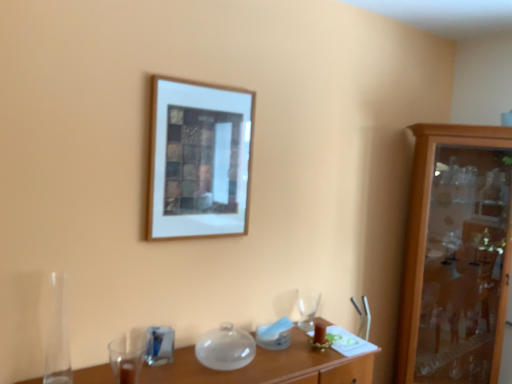
Image resolution: width=512 pixels, height=384 pixels. What do you see at coordinates (307, 308) in the screenshot?
I see `clear glass wine glass at center, the 2th tableware when ordered from left to right` at bounding box center [307, 308].

At what (x,y) coordinates should I click in order to perform the action: click on transparent glass vase at lower left. Please return your answer as a coordinate pair (x, y). Looking at the image, I should click on (57, 334).

Find the location of `translucent glass table at lower center`. translucent glass table at lower center is located at coordinates (269, 367).

Is blue glass at lower left, the 1th tableware in the front-to-back sequence, next to wooden picture frame at upper center?

No, blue glass at lower left, the 1th tableware in the front-to-back sequence, is not with wooden picture frame at upper center.

Which point is more forward, [162,359] or [182,216]?

The point [162,359] is closer to the camera.

Looking at this image, considering the sizes of objects blue glass at lower left, the first tableware positioned from the left, and wooden picture frame at upper center in the image provided, who is shorter, blue glass at lower left, the first tableware positioned from the left, or wooden picture frame at upper center?

blue glass at lower left, the first tableware positioned from the left.

Is blue glass at lower left, the 2th tableware positioned from the right, inside the boundaries of wooden picture frame at upper center, or outside?

blue glass at lower left, the 2th tableware positioned from the right, is not inside wooden picture frame at upper center, it's outside.

Which is more to the left, transparent glass vase at lower left or blue glass at lower left, the 2th tableware positioned from the right?

From the viewer's perspective, transparent glass vase at lower left appears more on the left side.

Which point is more distant from viewer, (53,275) or (162,356)?

The point (162,356) is farther.

Consider the image. Measure the distance between transparent glass vase at lower left and blue glass at lower left, the 2th tableware in the back-to-front sequence.

The distance of transparent glass vase at lower left from blue glass at lower left, the 2th tableware in the back-to-front sequence, is 14.88 inches.

Could you tell me if transparent glass vase at lower left is turned towards blue glass at lower left, the 1th tableware in the front-to-back sequence?

No.

How far apart are wooden cabinet at right and transparent glass vase at lower left?

They are 2.20 meters apart.

From a real-world perspective, is wooden cabinet at right beneath transparent glass vase at lower left?

Actually, wooden cabinet at right is physically above transparent glass vase at lower left in the real world.

Are wooden cabinet at right and transparent glass vase at lower left beside each other?

wooden cabinet at right and transparent glass vase at lower left are clearly separated.

Does point (485, 310) come in front of point (55, 300)?

No, (485, 310) is further to viewer.

In the scene shown: Does wooden picture frame at upper center have a smaller size compared to wooden cabinet at right?

Correct, wooden picture frame at upper center occupies less space than wooden cabinet at right.

Which point is more forward, (204, 84) or (450, 195)?

The point (204, 84) is closer.

Looking at this image, from a real-world perspective, who is located higher, wooden picture frame at upper center or wooden cabinet at right?

In real-world perspective, wooden picture frame at upper center is above.

You are a GUI agent. You are given a task and a screenshot of the screen. Output one action in this format:
    pyautogui.click(x=<x>, y=<y>)
    Task: Click on the picture frame that is on the left side of wooden cabinet at right
    This screenshot has height=384, width=512.
    Given the screenshot: What is the action you would take?
    pyautogui.click(x=199, y=160)

From a real-world perspective, which is physically above, blue glass at lower left, the 2th tableware positioned from the right, or transparent glass vase at lower left?

transparent glass vase at lower left is physically above.

Which object is positioned more to the right, blue glass at lower left, the 1th tableware in the front-to-back sequence, or transparent glass vase at lower left?

Positioned to the right is blue glass at lower left, the 1th tableware in the front-to-back sequence.

From the image's perspective, who appears lower, blue glass at lower left, the first tableware positioned from the left, or transparent glass vase at lower left?

blue glass at lower left, the first tableware positioned from the left, is shown below in the image.

Is blue glass at lower left, the 1th tableware in the front-to-back sequence, in front of or behind transparent glass vase at lower left in the image?

Clearly, blue glass at lower left, the 1th tableware in the front-to-back sequence, is behind transparent glass vase at lower left.

Is translucent glass table at lower center thinner than clear glass wine glass at center, marked as the 1th tableware in a right-to-left arrangement?

In fact, translucent glass table at lower center might be wider than clear glass wine glass at center, marked as the 1th tableware in a right-to-left arrangement.

Does translucent glass table at lower center have a larger size compared to clear glass wine glass at center, marked as the 1th tableware in a right-to-left arrangement?

Correct, translucent glass table at lower center is larger in size than clear glass wine glass at center, marked as the 1th tableware in a right-to-left arrangement.

Is translucent glass table at lower center taller or shorter than clear glass wine glass at center, the first tableware from the back?

translucent glass table at lower center is taller than clear glass wine glass at center, the first tableware from the back.

Can you confirm if translucent glass table at lower center is positioned to the right of clear glass wine glass at center, the first tableware from the back?

No.

How different are the orientations of clear glass wine glass at center, the first tableware from the back, and translucent glass table at lower center in degrees?

They differ by 1.75 degrees in their facing directions.

From the image's perspective, between clear glass wine glass at center, the second tableware viewed from the front, and translucent glass table at lower center, which one is located above?

clear glass wine glass at center, the second tableware viewed from the front.

Is there a large distance between clear glass wine glass at center, the second tableware viewed from the front, and translucent glass table at lower center?

clear glass wine glass at center, the second tableware viewed from the front, is near translucent glass table at lower center, not far away.

Do you think clear glass wine glass at center, marked as the 1th tableware in a right-to-left arrangement, is within translucent glass table at lower center, or outside of it?

clear glass wine glass at center, marked as the 1th tableware in a right-to-left arrangement, is outside translucent glass table at lower center.

Locate an element on the screen. picture frame above the blue glass at lower left, the first tableware positioned from the left (from a real-world perspective) is located at coordinates (199, 160).

Find the location of a particular element. The height and width of the screenshot is (384, 512). glass vase above the blue glass at lower left, the first tableware positioned from the left (from the image's perspective) is located at coordinates (57, 334).

When comparing their distances from wooden picture frame at upper center, does blue glass at lower left, the 2th tableware positioned from the right, or translucent glass table at lower center seem closer?

blue glass at lower left, the 2th tableware positioned from the right.

Considering their positions, is transparent glass vase at lower left positioned closer to wooden cabinet at right than wooden picture frame at upper center?

wooden picture frame at upper center.

Considering their positions, is wooden picture frame at upper center positioned further to clear glass wine glass at center, the first tableware from the back, than translucent glass table at lower center?

wooden picture frame at upper center is positioned further to the anchor clear glass wine glass at center, the first tableware from the back.

Based on their spatial positions, is blue glass at lower left, the 2th tableware in the back-to-front sequence, or wooden cabinet at right further from transparent glass vase at lower left?

Based on the image, wooden cabinet at right appears to be further to transparent glass vase at lower left.

When comparing their distances from transparent glass vase at lower left, does wooden picture frame at upper center or clear glass wine glass at center, the first tableware from the back, seem closer?

Among the two, wooden picture frame at upper center is located nearer to transparent glass vase at lower left.

Which object lies further to the anchor point wooden picture frame at upper center, translucent glass table at lower center or transparent glass vase at lower left?

translucent glass table at lower center.

Estimate the real-world distances between objects in this image. Which object is further from translucent glass table at lower center, clear glass wine glass at center, the 2th tableware when ordered from left to right, or wooden picture frame at upper center?

wooden picture frame at upper center is further to translucent glass table at lower center.

Which object lies further to the anchor point wooden cabinet at right, blue glass at lower left, the 2th tableware in the back-to-front sequence, or transparent glass vase at lower left?

Among the two, transparent glass vase at lower left is located further to wooden cabinet at right.

The image size is (512, 384). I want to click on tableware between wooden picture frame at upper center and wooden cabinet at right from left to right, so click(307, 308).

You are a GUI agent. You are given a task and a screenshot of the screen. Output one action in this format:
    pyautogui.click(x=<x>, y=<y>)
    Task: Click on the table between blue glass at lower left, the 2th tableware in the back-to-front sequence, and wooden cabinet at right from left to right
    Image resolution: width=512 pixels, height=384 pixels.
    Given the screenshot: What is the action you would take?
    pyautogui.click(x=269, y=367)

Locate an element on the screen. This screenshot has width=512, height=384. tableware between transparent glass vase at lower left and translucent glass table at lower center from left to right is located at coordinates (160, 345).

In order to click on glass vase located between translucent glass table at lower center and clear glass wine glass at center, the 2th tableware when ordered from left to right, in the depth direction in this screenshot , I will do `click(57, 334)`.